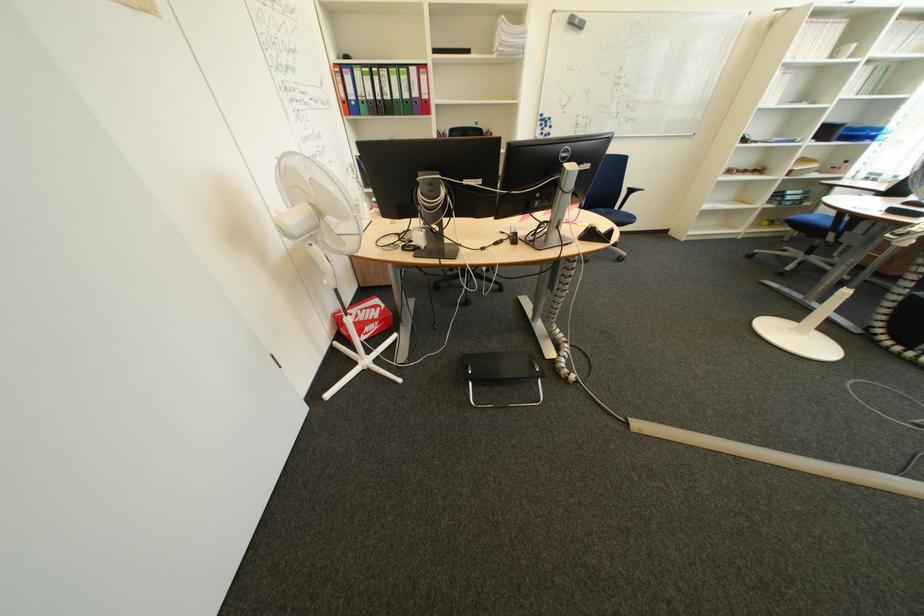
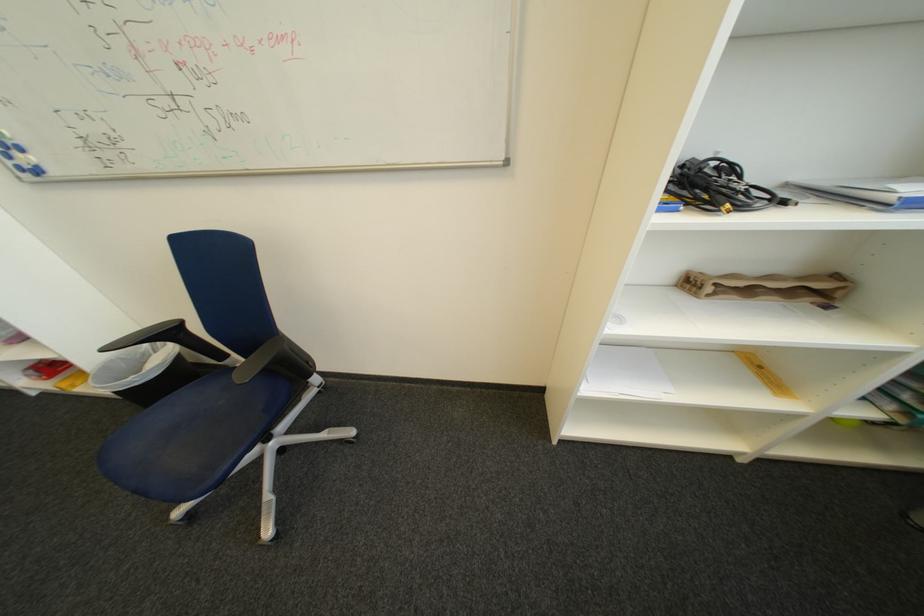
What movement of the cameraman would produce the second image?

The movement direction of the cameraman is right, forward.